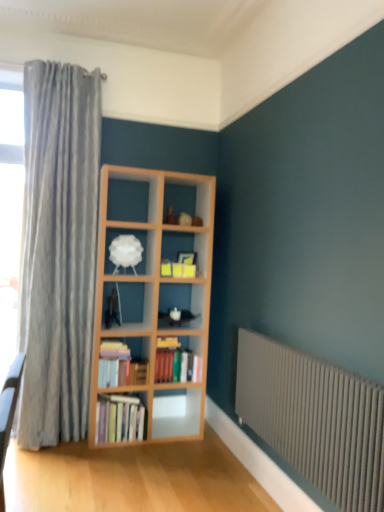
Question: Is hardcover books at center, acting as the 2th book starting from the bottom, with gray metallic radiator at lower right?

Choices:
 (A) no
 (B) yes

Answer: (A)

Question: Does hardcover books at center, acting as the 2th book starting from the bottom, have a lesser width compared to gray metallic radiator at lower right?

Choices:
 (A) no
 (B) yes

Answer: (A)

Question: From the image's perspective, is hardcover books at center, placed as the second book when sorted from top to bottom, located above gray metallic radiator at lower right?

Choices:
 (A) no
 (B) yes

Answer: (B)

Question: From a real-world perspective, is hardcover books at center, placed as the second book when sorted from top to bottom, physically above gray metallic radiator at lower right?

Choices:
 (A) no
 (B) yes

Answer: (B)

Question: Is hardcover books at center, placed as the second book when sorted from top to bottom, far away from gray metallic radiator at lower right?

Choices:
 (A) no
 (B) yes

Answer: (B)

Question: From the image's perspective, is gray metallic radiator at lower right positioned above or below hardcover books at center, arranged as the first book when ordered from the bottom?

Choices:
 (A) below
 (B) above

Answer: (B)

Question: Is gray metallic radiator at lower right wider or thinner than hardcover books at center, which is the third book from top to bottom?

Choices:
 (A) thin
 (B) wide

Answer: (A)

Question: In the image, is gray metallic radiator at lower right positioned in front of or behind hardcover books at center, which is the third book from top to bottom?

Choices:
 (A) behind
 (B) front

Answer: (B)

Question: Does point (339, 385) appear closer or farther from the camera than point (119, 400)?

Choices:
 (A) closer
 (B) farther

Answer: (A)

Question: Is hardcover books at center-left, which is counted as the 1th book, starting from the top, inside the boundaries of hardcover books at center, placed as the second book when sorted from top to bottom, or outside?

Choices:
 (A) outside
 (B) inside

Answer: (A)

Question: Is point (110, 364) closer or farther from the camera than point (175, 353)?

Choices:
 (A) farther
 (B) closer

Answer: (B)

Question: Would you say hardcover books at center-left, which is counted as the 1th book, starting from the top, is to the left or to the right of hardcover books at center, placed as the second book when sorted from top to bottom, in the picture?

Choices:
 (A) right
 (B) left

Answer: (B)

Question: In the image, is hardcover books at center-left, which is counted as the 1th book, starting from the top, positioned in front of or behind hardcover books at center, acting as the 2th book starting from the bottom?

Choices:
 (A) behind
 (B) front

Answer: (B)

Question: From their relative heights in the image, would you say hardcover books at center, which is the third book from top to bottom, is taller or shorter than hardcover books at center, placed as the second book when sorted from top to bottom?

Choices:
 (A) short
 (B) tall

Answer: (B)

Question: Relative to hardcover books at center, placed as the second book when sorted from top to bottom, is hardcover books at center, arranged as the first book when ordered from the bottom, in front or behind?

Choices:
 (A) front
 (B) behind

Answer: (A)